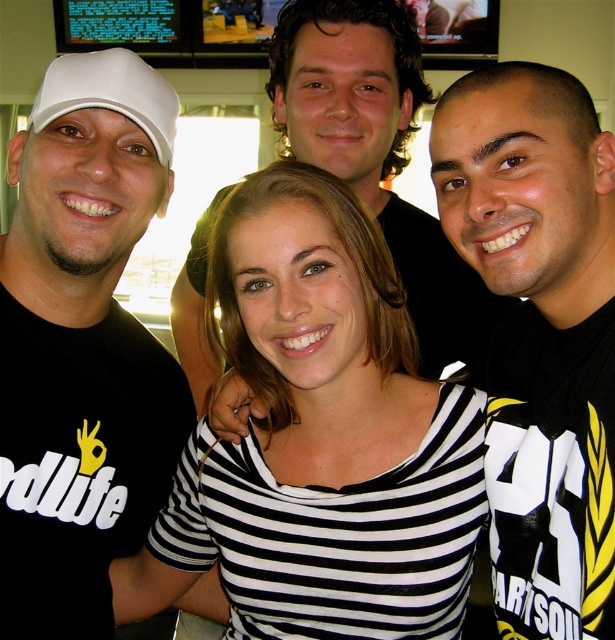
You are a photographer adjusting the lighting for a group photo. You need to ensure that both the black and white striped shirt at center and the matte black shirt at center are evenly lit. Given their current distance apart, can you estimate if the lighting setup will require adjustment to cover both shirts adequately?

The black and white striped shirt at center and the matte black shirt at center are 19.41 inches apart from each other. Since the distance between them is relatively small, the existing lighting setup should adequately cover both shirts without needing major adjustments, provided the light source is positioned to encompass the group.